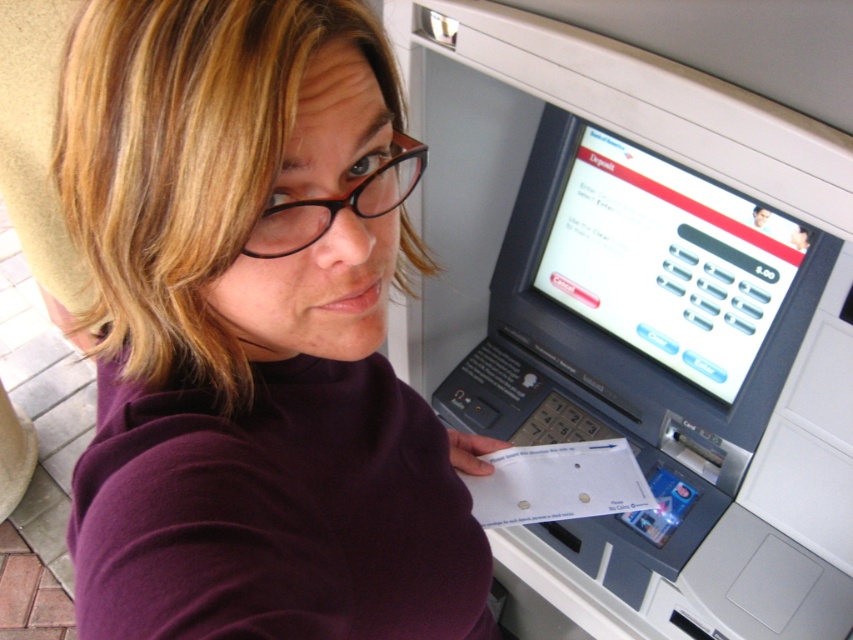
Question: Does purple turtleneck sweater at center have a smaller size compared to black plastic glasses at upper center?

Choices:
 (A) yes
 (B) no

Answer: (B)

Question: Does purple turtleneck sweater at center have a greater width compared to black plastic glasses at upper center?

Choices:
 (A) yes
 (B) no

Answer: (A)

Question: From the image, what is the correct spatial relationship of purple turtleneck sweater at center in relation to black plastic glasses at upper center?

Choices:
 (A) left
 (B) right

Answer: (A)

Question: Which point is farther to the camera?

Choices:
 (A) black plastic glasses at upper center
 (B) purple turtleneck sweater at center

Answer: (A)